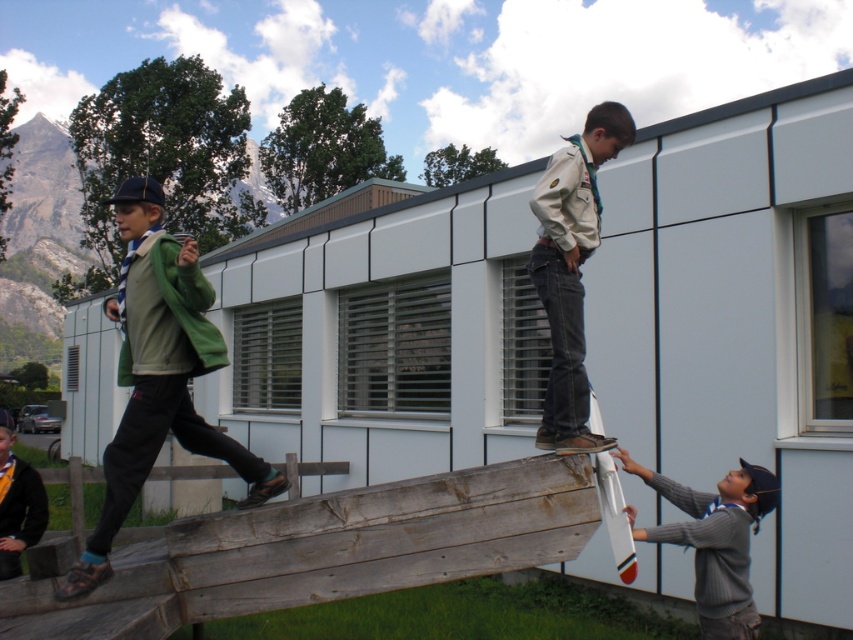
Question: Which object appears closest to the camera in this image?

Choices:
 (A) denim jeans at upper center
 (B) gray knitted sweater at lower right

Answer: (A)

Question: Which point is farther from the camera taking this photo?

Choices:
 (A) (718, 554)
 (B) (256, 493)
 (C) (554, 442)

Answer: (A)

Question: Can you confirm if green fabric jacket at left is positioned above denim jeans at upper center?

Choices:
 (A) yes
 (B) no

Answer: (B)

Question: Which object is farther from the camera taking this photo?

Choices:
 (A) green fabric jacket at left
 (B) denim jeans at upper center
 (C) gray knitted sweater at lower right

Answer: (C)

Question: Can you confirm if denim jeans at upper center is positioned to the right of gray knitted sweater at lower right?

Choices:
 (A) no
 (B) yes

Answer: (A)

Question: Can you confirm if green fabric jacket at left is wider than denim jeans at upper center?

Choices:
 (A) no
 (B) yes

Answer: (A)